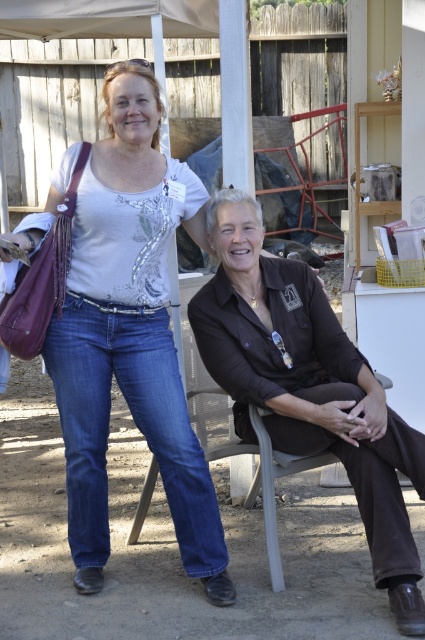
Question: Observing the image, what is the correct spatial positioning of denim jeans at center in reference to denim jeans at lower left?

Choices:
 (A) left
 (B) right

Answer: (A)

Question: Can you confirm if brown matte shirt at center is positioned to the left of denim jeans at lower left?

Choices:
 (A) yes
 (B) no

Answer: (A)

Question: Which object is positioned closest to the denim jeans at lower left?

Choices:
 (A) denim jeans at center
 (B) brown matte shirt at center

Answer: (B)

Question: Estimate the real-world distances between objects in this image. Which object is closer to the denim jeans at lower left?

Choices:
 (A) denim jeans at center
 (B) brown matte shirt at center
 (C) denim jeans at left

Answer: (B)

Question: Where is denim jeans at center located in relation to denim jeans at lower left in the image?

Choices:
 (A) right
 (B) left

Answer: (B)

Question: Which of these objects is positioned farthest from the brown matte shirt at center?

Choices:
 (A) denim jeans at left
 (B) denim jeans at center
 (C) denim jeans at lower left

Answer: (B)